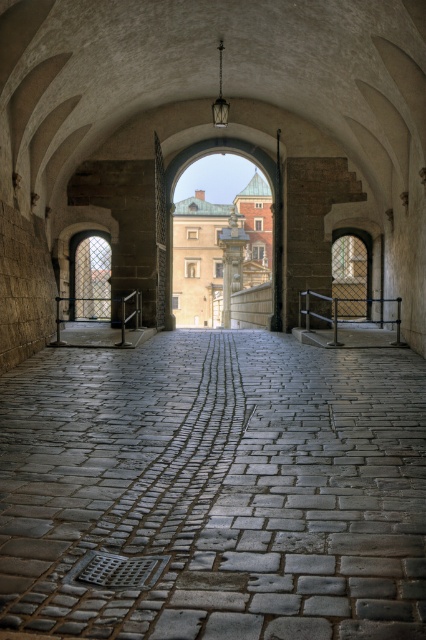
You are a tour guide leading a group through a historical site. You need to inform your group about the distance between the gray cobblestone path at center and the smooth stone pillar at center. What do you tell them?

The distance between the gray cobblestone path at center and the smooth stone pillar at center is 100.17 feet.

You are a maintenance worker needing to place a 1.2 meter wide equipment on the gray cobblestone path at center or the smooth stone pillar at center. Which surface can accommodate it?

The smooth stone pillar at center is larger than the gray cobblestone path at center, so the equipment can be placed on the smooth stone pillar at center since it has enough space.

You are a tour guide leading a group through a historical site. You need to direct your visitors to walk along the gray cobblestone path at center and pass by the smooth stone pillar at center. Based on their positions, which object should your visitors encounter first?

The gray cobblestone path at center is in front of the smooth stone pillar at center, so visitors will first encounter the gray cobblestone path at center before reaching the smooth stone pillar at center.